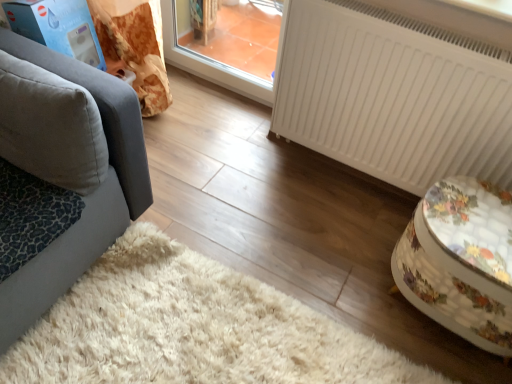
Question: Is floral fabric ottoman at right positioned behind leopard print fabric cat bed at lower left?

Choices:
 (A) yes
 (B) no

Answer: (A)

Question: From a real-world perspective, does floral fabric ottoman at right stand above leopard print fabric cat bed at lower left?

Choices:
 (A) no
 (B) yes

Answer: (A)

Question: Would you say floral fabric ottoman at right is outside leopard print fabric cat bed at lower left?

Choices:
 (A) yes
 (B) no

Answer: (A)

Question: Would you say floral fabric ottoman at right contains leopard print fabric cat bed at lower left?

Choices:
 (A) no
 (B) yes

Answer: (A)

Question: Does floral fabric ottoman at right come in front of leopard print fabric cat bed at lower left?

Choices:
 (A) no
 (B) yes

Answer: (A)

Question: Can you confirm if floral fabric ottoman at right is bigger than leopard print fabric cat bed at lower left?

Choices:
 (A) no
 (B) yes

Answer: (B)

Question: Is there a large distance between white matte radiator at right and gray fabric pillow at left?

Choices:
 (A) no
 (B) yes

Answer: (A)

Question: Is white matte radiator at right thinner than gray fabric pillow at left?

Choices:
 (A) no
 (B) yes

Answer: (B)

Question: Is white matte radiator at right wider than gray fabric pillow at left?

Choices:
 (A) yes
 (B) no

Answer: (B)

Question: Is white matte radiator at right surrounding gray fabric pillow at left?

Choices:
 (A) yes
 (B) no

Answer: (B)

Question: Is white matte radiator at right beside gray fabric pillow at left?

Choices:
 (A) no
 (B) yes

Answer: (A)

Question: Is white matte radiator at right taller than gray fabric pillow at left?

Choices:
 (A) yes
 (B) no

Answer: (A)

Question: From the image's perspective, is leopard print fabric cat bed at lower left beneath gray fabric pillow at left?

Choices:
 (A) yes
 (B) no

Answer: (A)